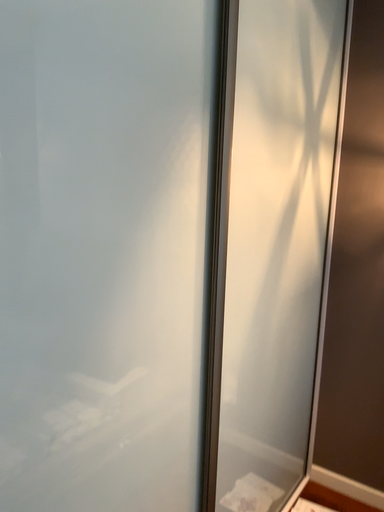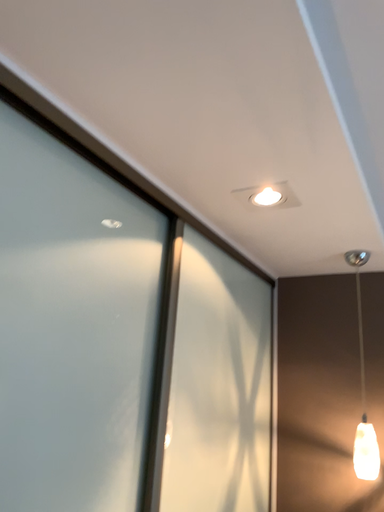
Question: How did the camera likely rotate when shooting the video?

Choices:
 (A) rotated left
 (B) rotated right

Answer: (B)